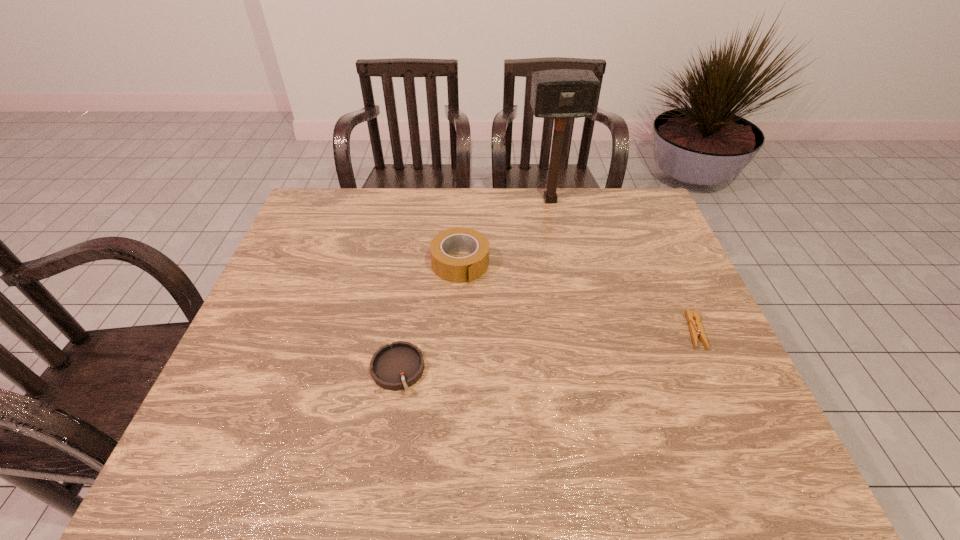
Where is `vacant space located 0.150m at the edge of the second farthest object`? Image resolution: width=960 pixels, height=540 pixels. vacant space located 0.150m at the edge of the second farthest object is located at coordinates (491, 322).

Locate an element on the screen. free space located at the edge of the second farthest object is located at coordinates (520, 378).

I want to click on free space located on the head of the second object from right to left, so click(565, 248).

In order to click on vacant position located on the head of the second object from right to left in this screenshot , I will do `click(567, 254)`.

In order to click on vacant space situated on the head of the second object from right to left in this screenshot , I will do `click(566, 250)`.

In order to click on object that is at the far edge in this screenshot , I will do `click(558, 94)`.

Where is `object at the near edge`? This screenshot has width=960, height=540. object at the near edge is located at coordinates (397, 366).

You are a GUI agent. You are given a task and a screenshot of the screen. Output one action in this format:
    pyautogui.click(x=<x>, y=<y>)
    Task: Click on the object present at the right edge
    This screenshot has width=960, height=540.
    Given the screenshot: What is the action you would take?
    pyautogui.click(x=696, y=329)

You are a GUI agent. You are given a task and a screenshot of the screen. Output one action in this format:
    pyautogui.click(x=<x>, y=<y>)
    Task: Click on the vacant space at the far edge
    
    Given the screenshot: What is the action you would take?
    pyautogui.click(x=460, y=194)

Identify the location of free region at the near edge of the desktop. (535, 418).